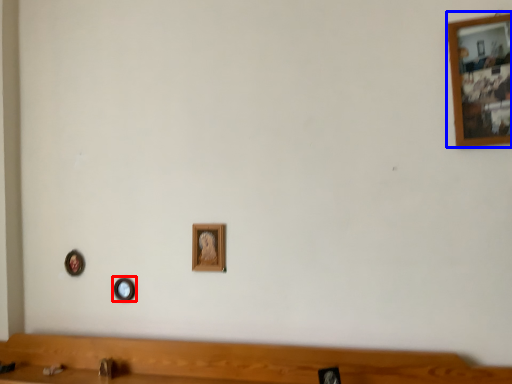
Question: Which of the following is the closest to the observer, picture frame (highlighted by a red box) or picture frame (highlighted by a blue box)?

Choices:
 (A) picture frame
 (B) picture frame

Answer: (B)